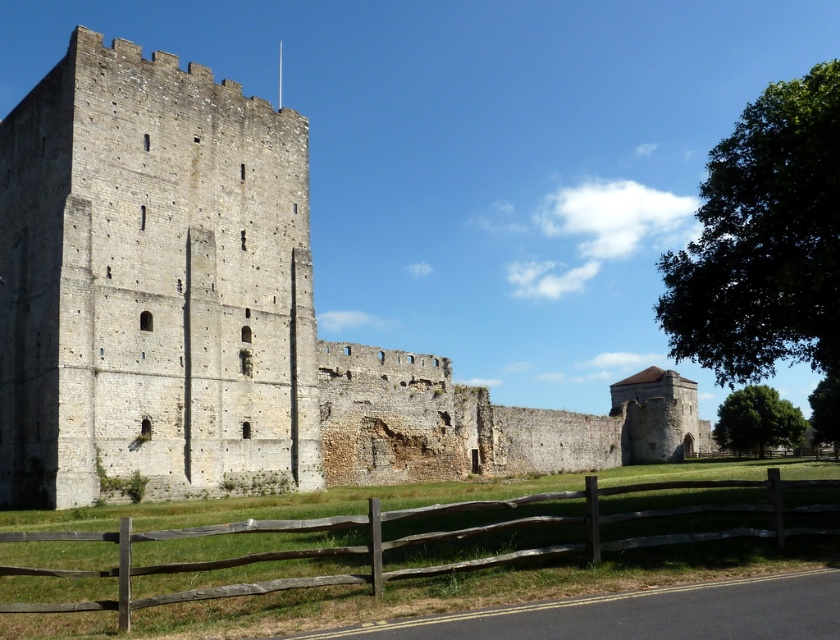
You are standing in front of the historic stone structure and want to touch both the stone wall at left and the brown wooden fence at lower center. Which object will you reach first as you move towards the structure?

You will reach the stone wall at left first because it is closer to you than the brown wooden fence at lower center, which is further away.

In the scene shown: You are an architect assessing the structural integrity of the stone wall at left and the brown wooden fence at lower center. Based on their heights, which one might require more immediate attention for safety concerns?

The stone wall at left is much taller than the brown wooden fence at lower center, so it might require more immediate attention for safety concerns due to its greater height increasing the risk of collapse or falling debris.